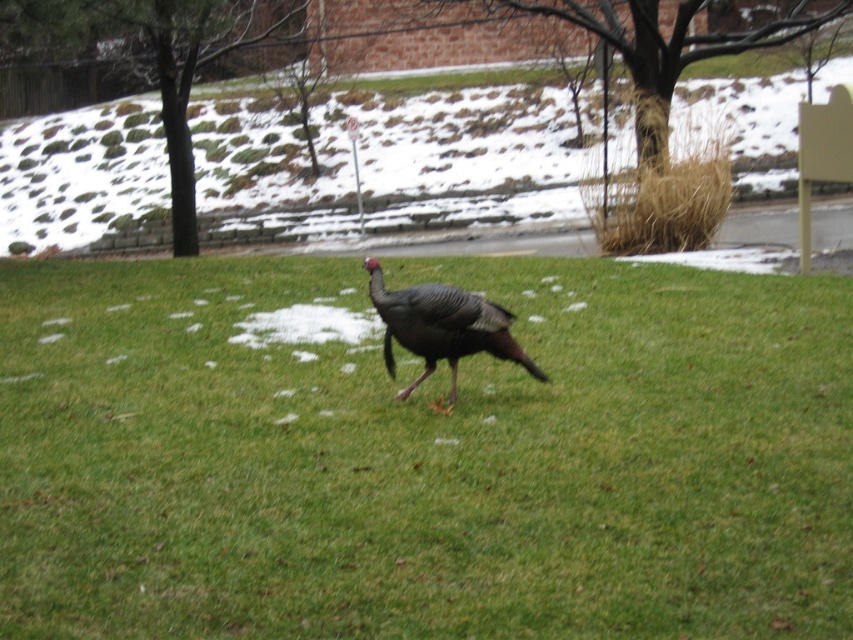
You are a photographer trying to capture the gray matte turkey at center in the image. The camera you are using has a limited field of view. Considering the green grass at center is also in the frame, which object should you focus on to ensure both are visible without zooming in or out?

Since the green grass at center is larger in size than the gray matte turkey at center, you should focus on the green grass at center to ensure both are visible without zooming in or out.

You are standing in the grassy area with snow patches and see two points marked in the image. The first point is at coordinates point (703, 280) and the second is at point (480, 316). If you want to reach both points starting from your current position, which point should you go to first to minimize the distance walked?

Point (703, 280) is further to the camera than point (480, 316). Therefore, you should go to point (480, 316) first as it is closer to you, minimizing the total distance walked.

You are a photographer trying to capture the gray matte turkey at center in the image. The green grass at center is blocking part of the turkey. Can you estimate if the grass is wider than the turkey?

The green grass at center has a larger width than the gray matte turkey at center, so yes, the grass is wider and might be blocking part of the turkey.